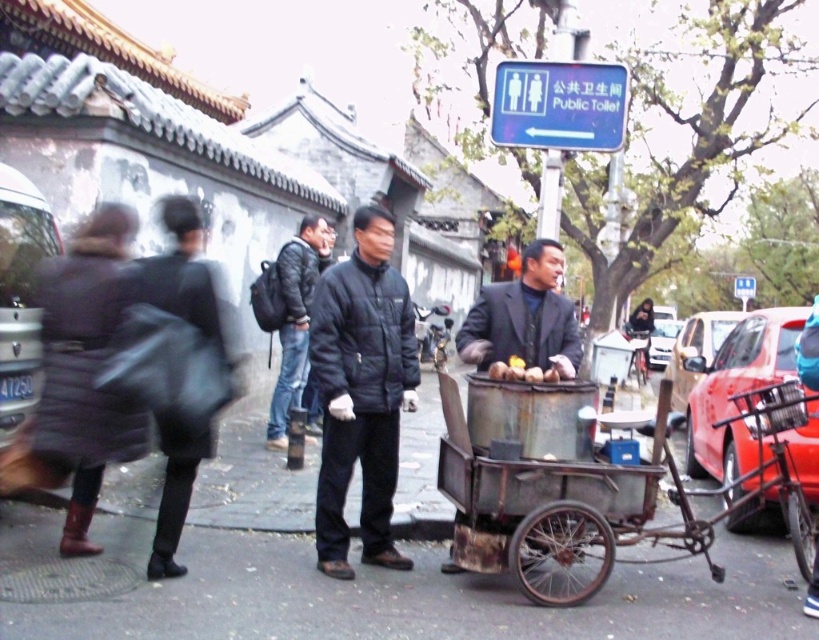
Question: In this image, where is metallic red car at right located relative to blue plastic sign at upper right?

Choices:
 (A) above
 (B) below

Answer: (B)

Question: Is metallic silver car at left smaller than dark gray jacket at center?

Choices:
 (A) no
 (B) yes

Answer: (A)

Question: Estimate the real-world distances between objects in this image. Which object is farther from the yellow matte apples at center?

Choices:
 (A) metallic red car at right
 (B) dark gray puffy jacket at center

Answer: (B)

Question: Which of the following is the closest to the observer?

Choices:
 (A) shiny red car at right
 (B) rusty metal cart at center
 (C) metallic silver car at left
 (D) black matte jacket at center

Answer: (B)

Question: Which of the following is the closest to the observer?

Choices:
 (A) (7, 406)
 (B) (528, 266)
 (C) (107, 595)
 (D) (646, 536)

Answer: (C)

Question: Can you confirm if metallic red car at right is smaller than yellow matte apples at center?

Choices:
 (A) no
 (B) yes

Answer: (A)